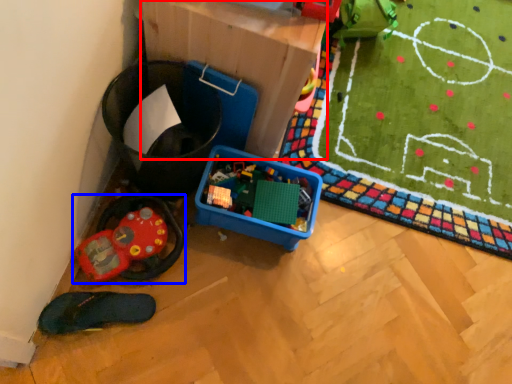
Question: Which object is further to the camera taking this photo, cardboard box (highlighted by a red box) or toy (highlighted by a blue box)?

Choices:
 (A) cardboard box
 (B) toy

Answer: (B)